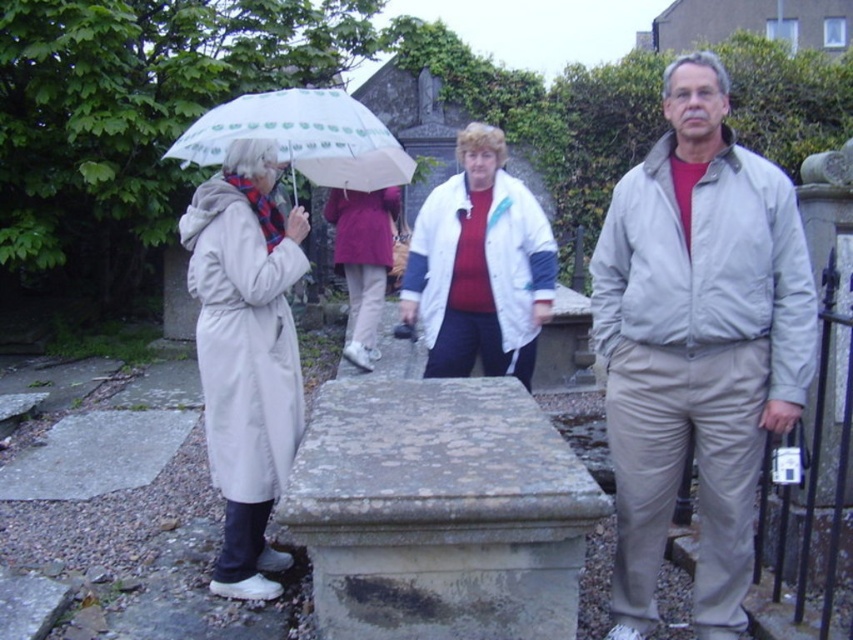
Question: Does transparent plastic umbrella at upper left come in front of maroon fabric coat at center?

Choices:
 (A) yes
 (B) no

Answer: (A)

Question: Which of these objects is positioned closest to the white matte jacket at center?

Choices:
 (A) maroon fabric coat at center
 (B) light beige jacket at right
 (C) light beige trench coat at left
 (D) transparent plastic umbrella at upper left

Answer: (D)

Question: Can you confirm if light beige trench coat at left is positioned below white matte jacket at center?

Choices:
 (A) yes
 (B) no

Answer: (A)

Question: Which of these objects is positioned farthest from the white matte jacket at center?

Choices:
 (A) transparent plastic umbrella at upper left
 (B) light beige jacket at right
 (C) light beige trench coat at left
 (D) maroon fabric coat at center

Answer: (D)

Question: Which of these objects is positioned closest to the light beige jacket at right?

Choices:
 (A) white matte jacket at center
 (B) maroon fabric coat at center

Answer: (A)

Question: Does light beige trench coat at left have a larger size compared to white matte jacket at center?

Choices:
 (A) no
 (B) yes

Answer: (B)